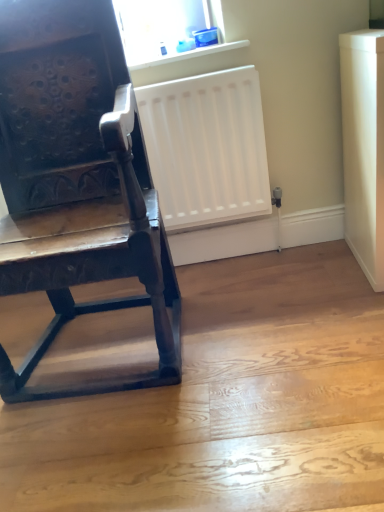
Question: Is dark wood chair at left bigger or smaller than white plastic window sill at upper center?

Choices:
 (A) small
 (B) big

Answer: (B)

Question: Which is correct: dark wood chair at left is inside white plastic window sill at upper center, or outside of it?

Choices:
 (A) outside
 (B) inside

Answer: (A)

Question: Considering the real-world distances, which object is farthest from the transparent plastic container at upper center?

Choices:
 (A) white plastic window sill at upper center
 (B) dark wood chair at left

Answer: (B)

Question: Based on their relative distances, which object is nearer to the white plastic window sill at upper center?

Choices:
 (A) transparent plastic container at upper center
 (B) dark wood chair at left

Answer: (A)